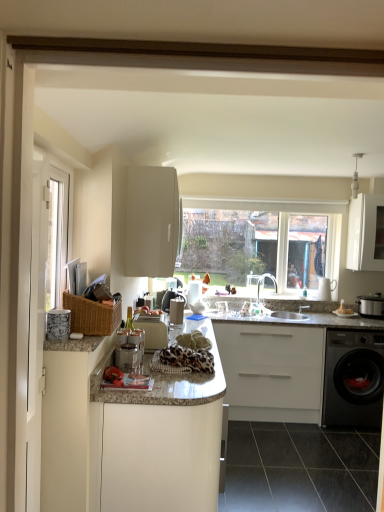
Question: Is white glossy countertop at center, arranged as the third cabinetry when viewed from the right, completely or partially outside of white matte cabinet at center, which appears as the second cabinetry when viewed from the right?

Choices:
 (A) yes
 (B) no

Answer: (A)

Question: Is white glossy countertop at center, the 2th cabinetry positioned from the left, taller than white matte cabinet at center, placed as the 3th cabinetry when sorted from left to right?

Choices:
 (A) yes
 (B) no

Answer: (A)

Question: Is white glossy countertop at center, the 2th cabinetry positioned from the left, not close to white matte cabinet at center, placed as the 3th cabinetry when sorted from left to right?

Choices:
 (A) yes
 (B) no

Answer: (A)

Question: Could white matte cabinet at center, placed as the 3th cabinetry when sorted from left to right, be considered to be inside white glossy countertop at center, the 2th cabinetry positioned from the left?

Choices:
 (A) no
 (B) yes

Answer: (A)

Question: Does white glossy countertop at center, arranged as the third cabinetry when viewed from the right, have a lesser height compared to white matte cabinet at center, which appears as the second cabinetry when viewed from the right?

Choices:
 (A) yes
 (B) no

Answer: (B)

Question: Considering the positions of point (112, 398) and point (36, 183), is point (112, 398) closer or farther from the camera than point (36, 183)?

Choices:
 (A) farther
 (B) closer

Answer: (A)

Question: Is white glossy countertop at center, the 2th cabinetry positioned from the left, inside or outside of white glossy screen door at left?

Choices:
 (A) inside
 (B) outside

Answer: (B)

Question: From the image's perspective, is white glossy countertop at center, arranged as the third cabinetry when viewed from the right, positioned above or below white glossy screen door at left?

Choices:
 (A) above
 (B) below

Answer: (B)

Question: In the image, is white glossy countertop at center, arranged as the third cabinetry when viewed from the right, positioned in front of or behind white glossy screen door at left?

Choices:
 (A) front
 (B) behind

Answer: (B)

Question: In terms of height, does white matte cabinet at center, placed as the 3th cabinetry when sorted from left to right, look taller or shorter compared to matte white bowl at right?

Choices:
 (A) short
 (B) tall

Answer: (B)

Question: Considering the positions of white matte cabinet at center, which appears as the second cabinetry when viewed from the right, and matte white bowl at right in the image, is white matte cabinet at center, which appears as the second cabinetry when viewed from the right, wider or thinner than matte white bowl at right?

Choices:
 (A) thin
 (B) wide

Answer: (B)

Question: Considering their positions, is white matte cabinet at center, placed as the 3th cabinetry when sorted from left to right, located in front of or behind matte white bowl at right?

Choices:
 (A) behind
 (B) front

Answer: (B)

Question: Looking at the image, does white matte cabinet at center, placed as the 3th cabinetry when sorted from left to right, seem bigger or smaller compared to matte white bowl at right?

Choices:
 (A) big
 (B) small

Answer: (A)

Question: Is white glossy screen door at left bigger or smaller than matte white bowl at right?

Choices:
 (A) big
 (B) small

Answer: (A)

Question: Considering the positions of white glossy screen door at left and matte white bowl at right in the image, is white glossy screen door at left taller or shorter than matte white bowl at right?

Choices:
 (A) tall
 (B) short

Answer: (A)